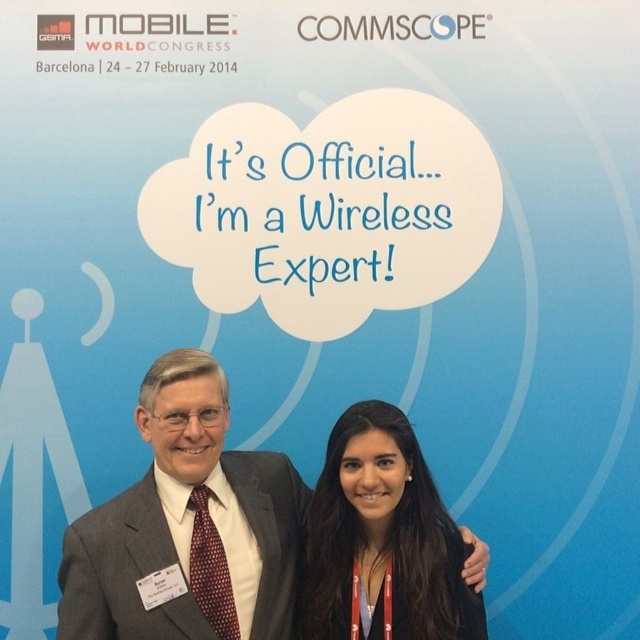
You are organizing a photo shoot for a fashion magazine and need to place a model wearing a gray suit at center and a model wearing a black leather jacket at lower center. Based on the scene description, which model should be positioned closer to the camera to maintain the size difference shown in the image?

The gray suit at center should be positioned closer to the camera than the black leather jacket at lower center to maintain the size difference shown in the image, as the gray suit at center has a larger size compared to the black leather jacket at lower center.

Where is the gray suit at center located in the image?

The gray suit at center is located at point 0.823 on the x axis and 0.294 on the y axis.